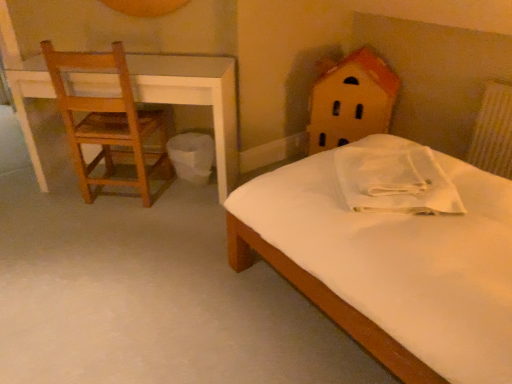
At what (x,y) coordinates should I click in order to perform the action: click on white matte bed at center. Please return your answer as a coordinate pair (x, y). Image resolution: width=512 pixels, height=384 pixels. Looking at the image, I should click on (400, 261).

Describe the element at coordinates (493, 131) in the screenshot. I see `white textured radiator at right` at that location.

This screenshot has width=512, height=384. I want to click on wooden chair at left, so click(x=109, y=126).

What is the approximate width of wooden house at upper right?

It is 50.23 centimeters.

In order to click on white cotton pillow at center in this screenshot , I will do `click(395, 181)`.

Is point (121, 109) positioned after point (490, 145)?

No, (121, 109) is in front of (490, 145).

Considering the relative sizes of wooden chair at left and white textured radiator at right in the image provided, is wooden chair at left shorter than white textured radiator at right?

In fact, wooden chair at left may be taller than white textured radiator at right.

Where is `radiator that is under the wooden chair at left (from a real-world perspective)`? The width and height of the screenshot is (512, 384). radiator that is under the wooden chair at left (from a real-world perspective) is located at coordinates click(493, 131).

Which of these two, wooden chair at left or white textured radiator at right, is thinner?

Thinner between the two is white textured radiator at right.

Can you see white matte bed at center touching white cotton pillow at center?

No, white matte bed at center is not next to white cotton pillow at center.

The image size is (512, 384). Identify the location of bed below the white cotton pillow at center (from the image's perspective). (400, 261).

Is white matte bed at center taller than white cotton pillow at center?

No, white matte bed at center is not taller than white cotton pillow at center.

Is white matte bed at center aimed at white cotton pillow at center?

No, white matte bed at center is not oriented towards white cotton pillow at center.

Which is nearer, (461,253) or (105,185)?

Point (461,253) is positioned closer to the camera compared to point (105,185).

Considering the positions of objects white matte bed at center and wooden chair at left in the image provided, who is behind, white matte bed at center or wooden chair at left?

wooden chair at left is further away from the camera.

Would you consider white matte bed at center to be distant from wooden chair at left?

That's right, there is a large distance between white matte bed at center and wooden chair at left.

The width and height of the screenshot is (512, 384). I want to click on bed to the left of white cotton pillow at center, so click(x=400, y=261).

In terms of size, does white cotton pillow at center appear bigger or smaller than white matte bed at center?

Clearly, white cotton pillow at center is smaller in size than white matte bed at center.

Relative to white matte bed at center, is white cotton pillow at center in front or behind?

white cotton pillow at center is positioned farther from the viewer than white matte bed at center.

Locate an element on the screen. pillow that appears on the left of white textured radiator at right is located at coordinates (395, 181).

Is white textured radiator at right positioned with its back to white cotton pillow at center?

white textured radiator at right does not have its back to white cotton pillow at center.

Does white textured radiator at right have a greater width compared to white cotton pillow at center?

No.

Would you say white textured radiator at right is inside or outside white cotton pillow at center?

The correct answer is: outside.

Is point (346, 130) positioned in front of point (488, 115)?

No, it is behind (488, 115).

Find the location of a particular element. The height and width of the screenshot is (384, 512). radiator located on the right of wooden house at upper right is located at coordinates (493, 131).

In the scene shown: How different are the orientations of wooden house at upper right and white textured radiator at right in degrees?

wooden house at upper right and white textured radiator at right are facing 34.5 degrees away from each other.

Is wooden house at upper right positioned beyond the bounds of white textured radiator at right?

Yes, wooden house at upper right is outside of white textured radiator at right.

From the image's perspective, is white plastic trash bin at lower center over wooden house at upper right?

No, from the image's perspective, white plastic trash bin at lower center is not above wooden house at upper right.

Would you say white plastic trash bin at lower center is outside wooden house at upper right?

white plastic trash bin at lower center is positioned outside wooden house at upper right.

Between white plastic trash bin at lower center and wooden house at upper right, which one appears on the right side from the viewer's perspective?

Positioned to the right is wooden house at upper right.

Considering the sizes of white plastic trash bin at lower center and wooden house at upper right in the image, is white plastic trash bin at lower center wider or thinner than wooden house at upper right?

Clearly, white plastic trash bin at lower center has less width compared to wooden house at upper right.

Identify the location of chair that is in front of the white textured radiator at right. tap(109, 126).

In the image, there is a white cotton pillow at center. Identify the location of bed below it (from the image's perspective). The image size is (512, 384). (400, 261).

When comparing their distances from white textured radiator at right, does white matte bed at center or wooden house at upper right seem further?

Based on the image, white matte bed at center appears to be further to white textured radiator at right.

Looking at the image, which one is located further to wooden chair at left, white textured radiator at right or white cotton pillow at center?

Among the two, white textured radiator at right is located further to wooden chair at left.

From the image, which object appears to be nearer to white matte bed at center, wooden chair at left or white plastic trash bin at lower center?

The object closer to white matte bed at center is white plastic trash bin at lower center.

Based on their spatial positions, is white textured radiator at right or wooden chair at left further from white plastic trash bin at lower center?

The object further to white plastic trash bin at lower center is white textured radiator at right.

Considering their positions, is white cotton pillow at center positioned closer to wooden chair at left than white plastic trash bin at lower center?

white plastic trash bin at lower center lies closer to wooden chair at left than the other object.

Estimate the real-world distances between objects in this image. Which object is closer to wooden chair at left, wooden house at upper right or white matte bed at center?

The object closer to wooden chair at left is wooden house at upper right.

Considering their positions, is wooden house at upper right positioned further to white textured radiator at right than white cotton pillow at center?

white cotton pillow at center is positioned further to the anchor white textured radiator at right.

Which object lies nearer to the anchor point white cotton pillow at center, white plastic trash bin at lower center or wooden chair at left?

white plastic trash bin at lower center is closer to white cotton pillow at center.

Locate an element on the screen. This screenshot has width=512, height=384. pillow between white matte bed at center and white plastic trash bin at lower center from front to back is located at coordinates (395, 181).

Image resolution: width=512 pixels, height=384 pixels. Find the location of `chair positioned between white matte bed at center and white plastic trash bin at lower center from near to far`. chair positioned between white matte bed at center and white plastic trash bin at lower center from near to far is located at coordinates (109, 126).

This screenshot has width=512, height=384. What are the coordinates of `pillow located between white plastic trash bin at lower center and wooden house at upper right in the left-right direction` in the screenshot? It's located at (395, 181).

You are a GUI agent. You are given a task and a screenshot of the screen. Output one action in this format:
    pyautogui.click(x=<x>, y=<y>)
    Task: Click on the pillow between white plastic trash bin at lower center and white textured radiator at right in the horizontal direction
    
    Given the screenshot: What is the action you would take?
    pyautogui.click(x=395, y=181)